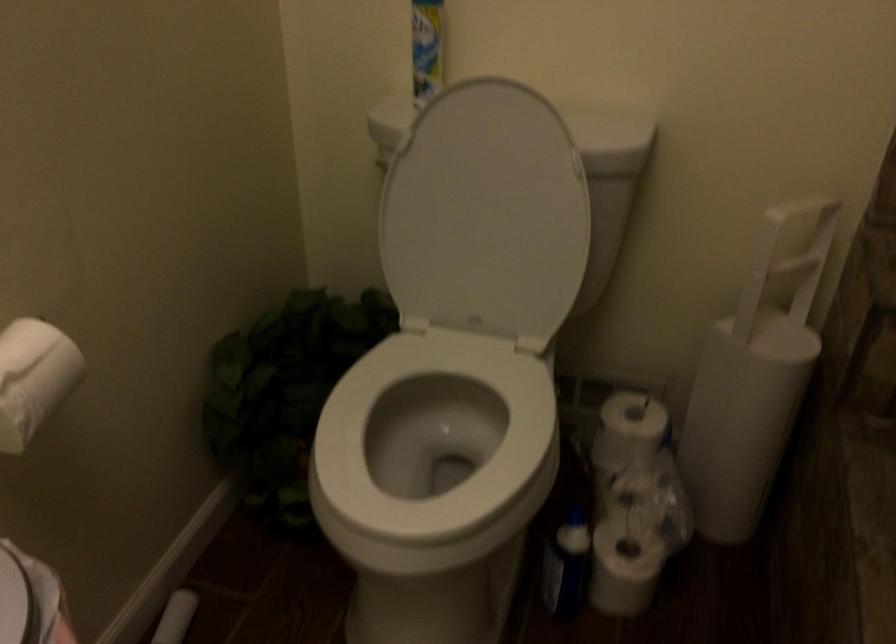
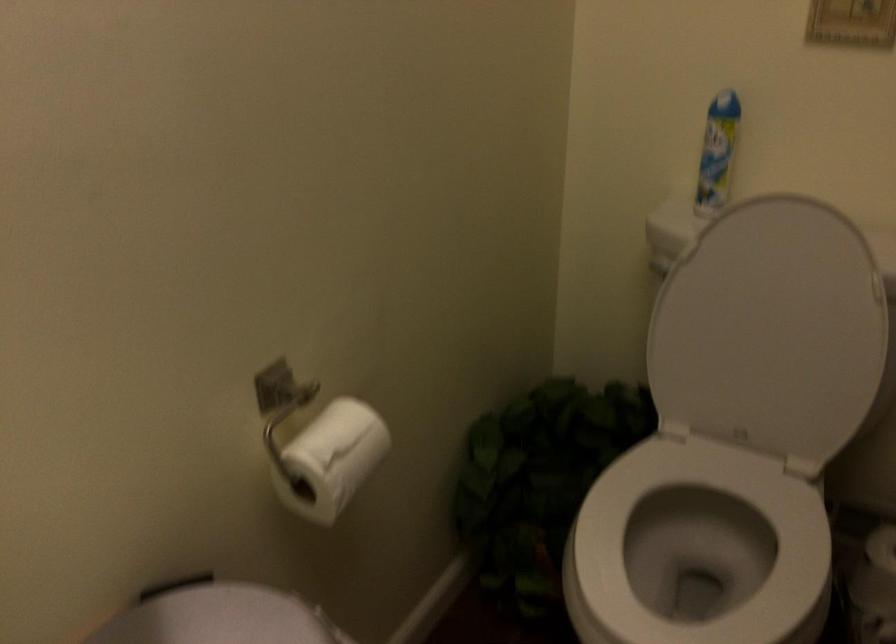
Question: Based on the continuous images, in which direction is the camera rotating? Reply with the corresponding letter.

Choices:
 (A) Left
 (B) Right
 (C) Up
 (D) Down

Answer: (A)